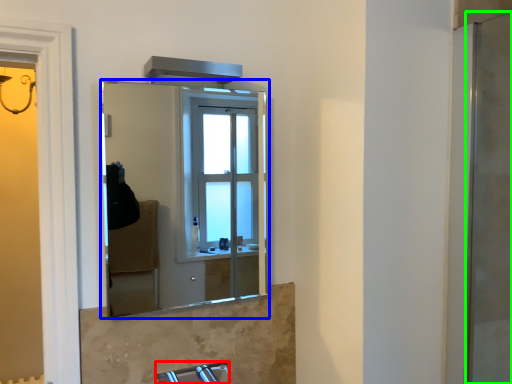
Question: Which object is the farthest from faucet (highlighted by a red box)? Choose among these: mirror (highlighted by a blue box) or screen door (highlighted by a green box).

Choices:
 (A) mirror
 (B) screen door

Answer: (A)